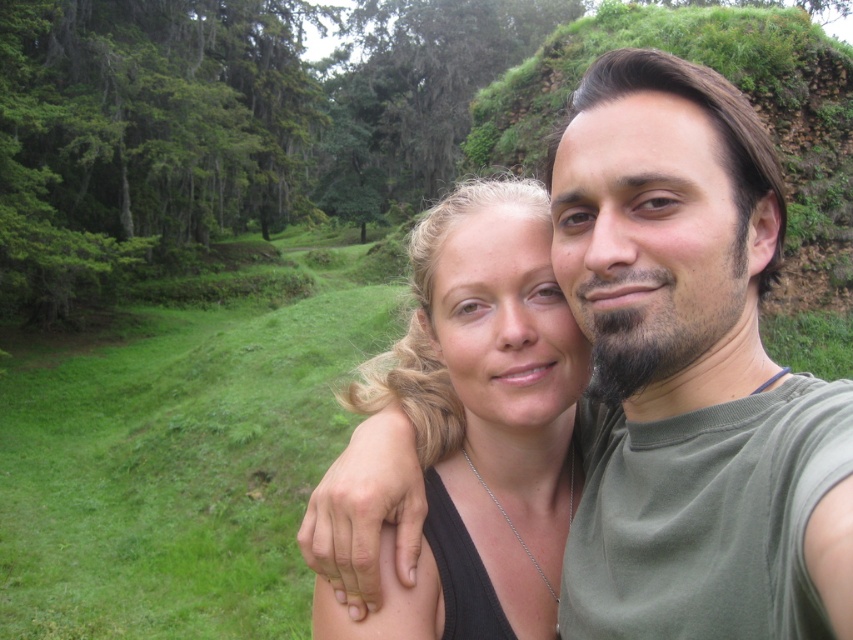
Question: Which of the following is the farthest from the observer?

Choices:
 (A) (541, 257)
 (B) (680, 467)

Answer: (A)

Question: Which point is closer to the camera?

Choices:
 (A) black matte hair at center
 (B) matte green shirt at center

Answer: (B)

Question: Is matte green shirt at center smaller than black matte hair at center?

Choices:
 (A) yes
 (B) no

Answer: (A)

Question: Which point is farther from the camera taking this photo?

Choices:
 (A) (447, 467)
 (B) (802, 508)

Answer: (A)

Question: Can you confirm if matte green shirt at center is positioned to the left of black matte hair at center?

Choices:
 (A) yes
 (B) no

Answer: (B)

Question: Is matte green shirt at center wider than black matte hair at center?

Choices:
 (A) yes
 (B) no

Answer: (B)